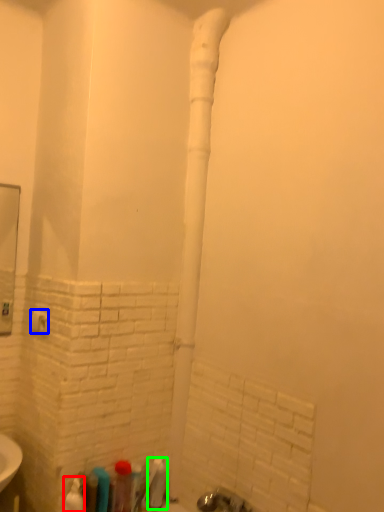
Question: Which object is the closest to the toiletry (highlighted by a red box)? Choose among these: towel bar (highlighted by a blue box) or toiletry (highlighted by a green box).

Choices:
 (A) towel bar
 (B) toiletry

Answer: (B)